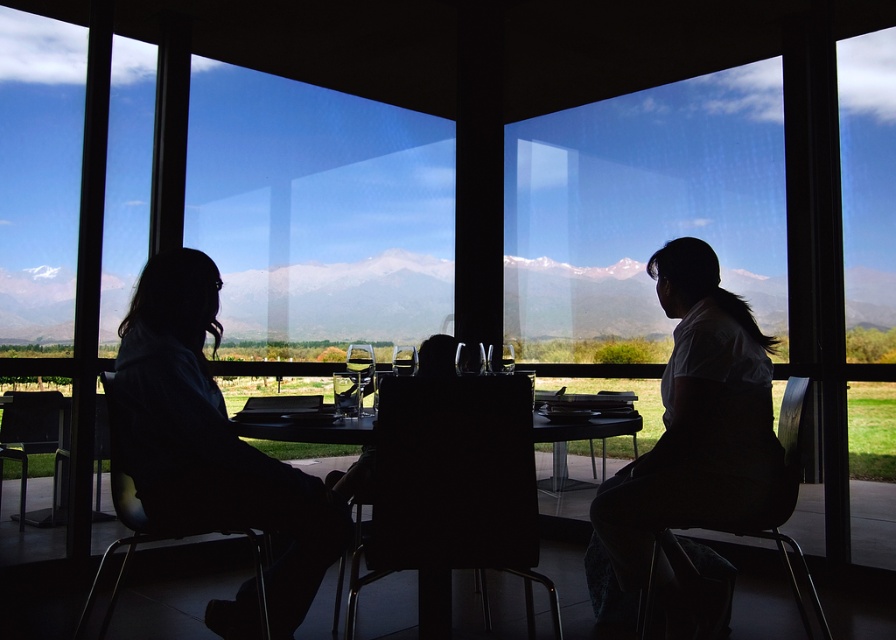
Question: Based on their relative distances, which object is nearer to the white matte shirt at center?

Choices:
 (A) silhouette dress at left
 (B) transparent glass wine glass at center
 (C) snowy mountain range at upper center
 (D) silhouette jacket at center

Answer: (A)

Question: Considering the real-world distances, which object is farthest from the silhouette dress at left?

Choices:
 (A) snowy mountain range at upper center
 (B) white matte shirt at center
 (C) transparent glass wine glass at center

Answer: (A)

Question: Which of the following is the farthest from the observer?

Choices:
 (A) (358, 397)
 (B) (332, 552)
 (C) (517, 268)
 (D) (197, 266)

Answer: (C)

Question: Is silhouette jacket at center to the right of transparent glass wine glass at center from the viewer's perspective?

Choices:
 (A) yes
 (B) no

Answer: (B)

Question: Does silhouette jacket at center appear over transparent glass wine glass at center?

Choices:
 (A) no
 (B) yes

Answer: (A)

Question: Can you confirm if silhouette jacket at center is thinner than transparent glass wine glass at center?

Choices:
 (A) yes
 (B) no

Answer: (B)